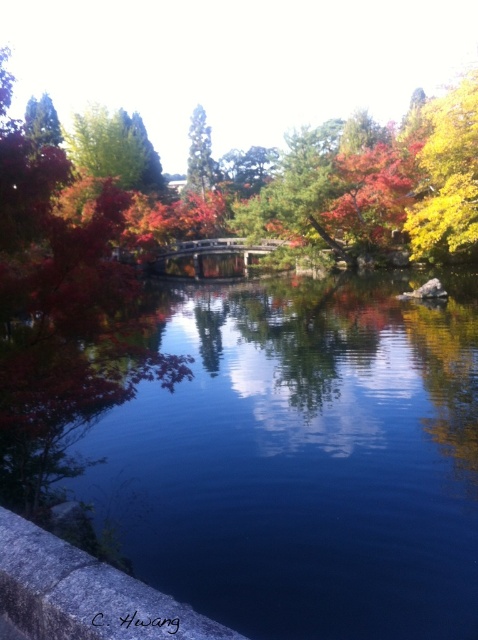
Which is below, blue glassy river at center or green matte tree at upper center?

blue glassy river at center is below.

Based on the photo, does blue glassy river at center appear under green matte tree at upper center?

Correct, blue glassy river at center is located below green matte tree at upper center.

Who is more distant from viewer, (423,339) or (203,122)?

The point (203,122) is behind.

The width and height of the screenshot is (478, 640). I want to click on blue glassy river at center, so click(301, 458).